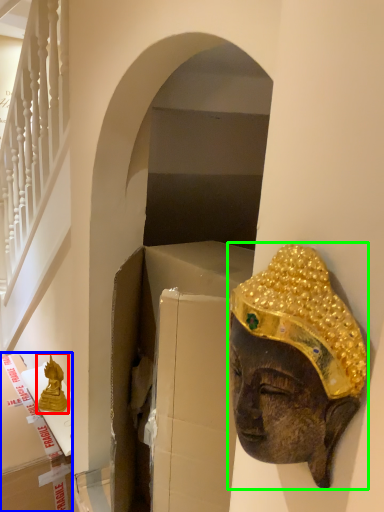
Question: Considering the real-world distances, which object is farthest from statue (highlighted by a red box)? cardboard box (highlighted by a blue box) or person (highlighted by a green box)?

Choices:
 (A) cardboard box
 (B) person

Answer: (B)